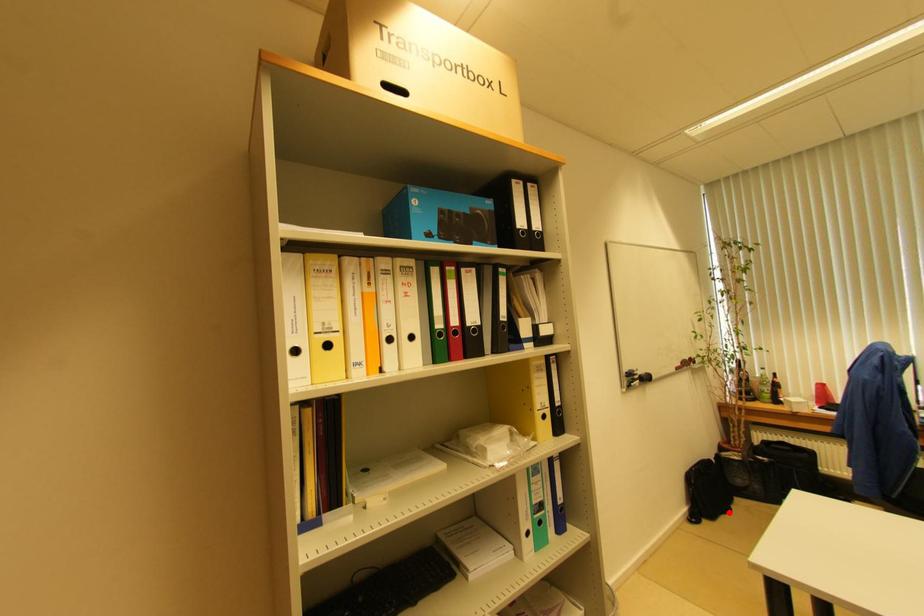
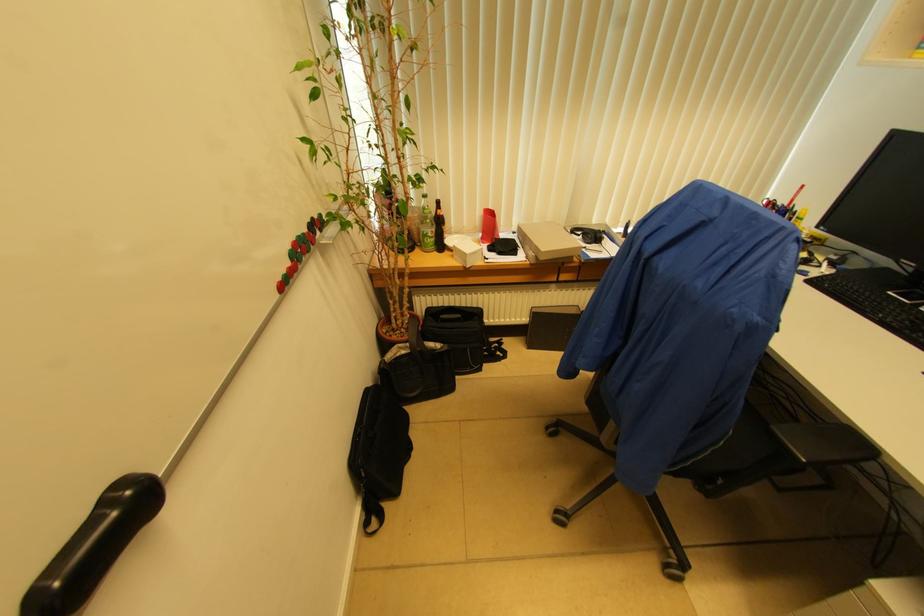
Find the pixel in the second image that matches the highlighted location in the first image.

(409, 451)